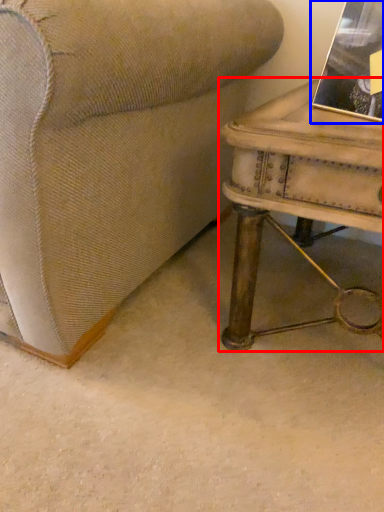
Question: Which of the following is the closest to the observer, table (highlighted by a red box) or book (highlighted by a blue box)?

Choices:
 (A) table
 (B) book

Answer: (A)